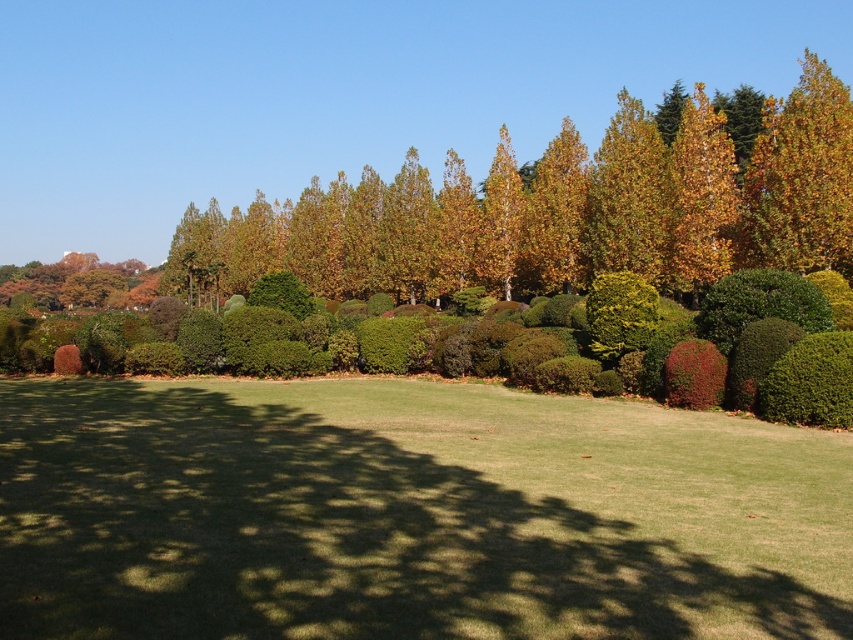
The width and height of the screenshot is (853, 640). Describe the element at coordinates (410, 513) in the screenshot. I see `green grass at center` at that location.

I want to click on green grass at center, so click(x=410, y=513).

I want to click on green grass at center, so click(410, 513).

Image resolution: width=853 pixels, height=640 pixels. What do you see at coordinates (563, 209) in the screenshot? I see `golden yellow leaves at upper center` at bounding box center [563, 209].

Consider the image. Can you confirm if golden yellow leaves at upper center is positioned to the right of golden yellow leaves at upper right?

In fact, golden yellow leaves at upper center is to the left of golden yellow leaves at upper right.

The width and height of the screenshot is (853, 640). I want to click on golden yellow leaves at upper center, so click(563, 209).

The height and width of the screenshot is (640, 853). I want to click on golden yellow leaves at upper center, so click(x=563, y=209).

Which is behind, point (785, 253) or point (700, 99)?

Point (700, 99)

Which is in front, point (827, 218) or point (677, 257)?

Point (827, 218) is more forward.

The width and height of the screenshot is (853, 640). In order to click on golden yellow leaves at upper right in this screenshot , I will do `click(799, 179)`.